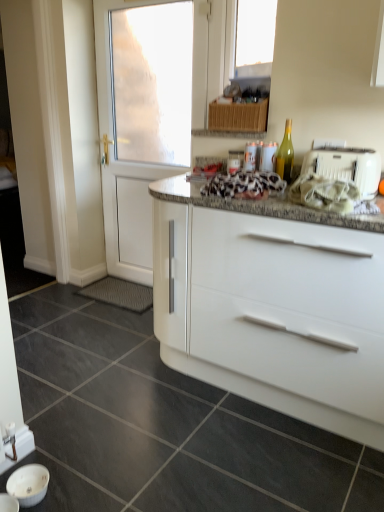
This screenshot has width=384, height=512. Identify the location of free area in between white glossy sink at lower left and white glossy cabinet at center. (187, 435).